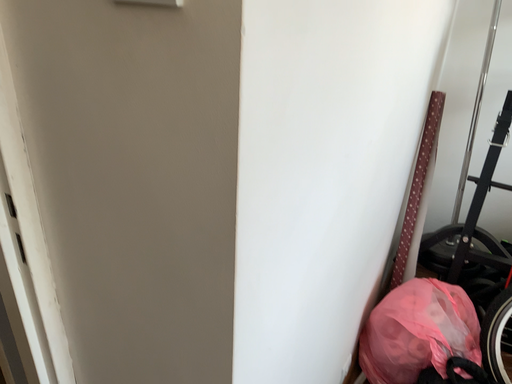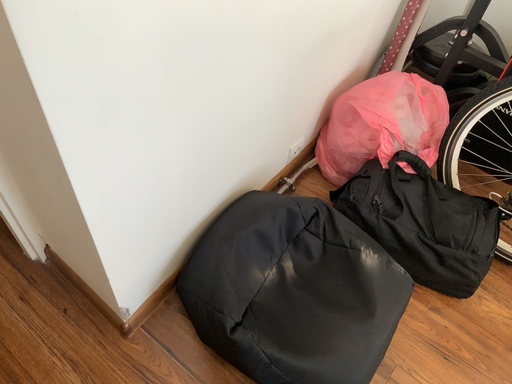
Question: Which way did the camera rotate in the video?

Choices:
 (A) rotated downward
 (B) rotated upward

Answer: (A)